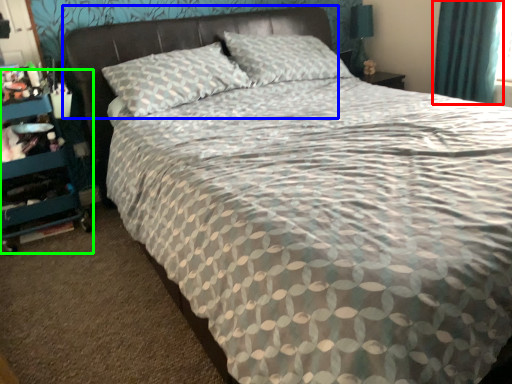
Question: Estimate the real-world distances between objects in this image. Which object is farther from curtain (highlighted by a red box), headboard (highlighted by a blue box) or dresser (highlighted by a green box)?

Choices:
 (A) headboard
 (B) dresser

Answer: (B)